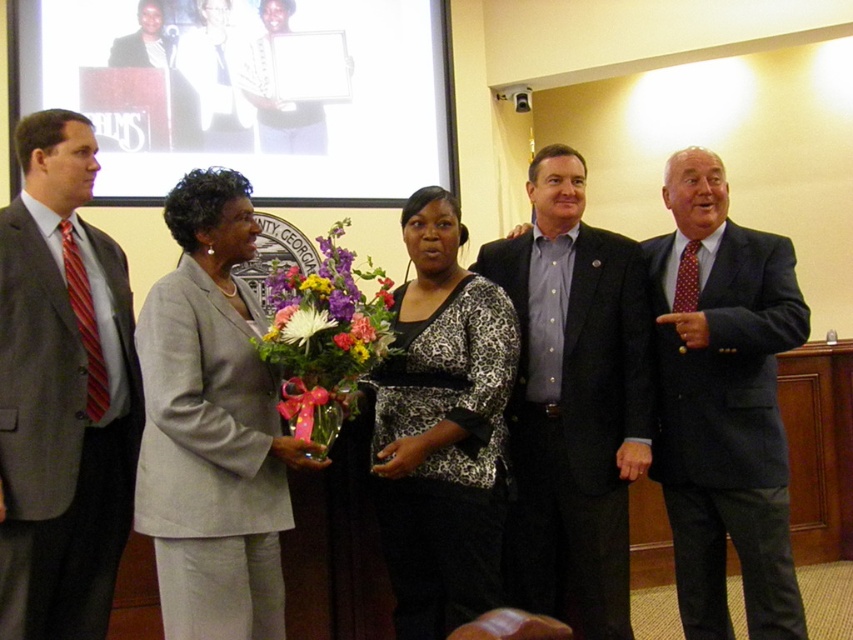
Question: Is leopard print blouse at center further to the viewer compared to vibrant floral bouquet at center?

Choices:
 (A) no
 (B) yes

Answer: (B)

Question: Among these objects, which one is farthest from the camera?

Choices:
 (A) dark blue suit at right
 (B) dark blue suit at center
 (C) vibrant floral bouquet at center
 (D) leopard print blouse at center

Answer: (B)

Question: Does light gray suit at center appear over vibrant floral bouquet at center?

Choices:
 (A) yes
 (B) no

Answer: (B)

Question: Which object is closer to the camera taking this photo?

Choices:
 (A) light gray suit at center
 (B) leopard print blouse at center
 (C) dark blue suit at right

Answer: (A)

Question: Does dark blue suit at center come behind dark blue suit at right?

Choices:
 (A) yes
 (B) no

Answer: (A)

Question: Which point is closer to the camera?

Choices:
 (A) (71, 420)
 (B) (590, 273)
 (C) (364, 346)

Answer: (A)